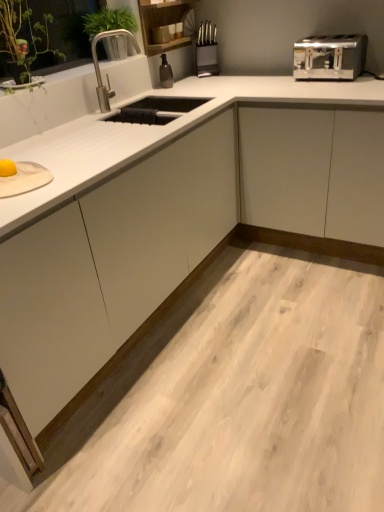
The width and height of the screenshot is (384, 512). I want to click on satin silver toaster at upper right, so point(330,57).

Identify the location of green leafy plant at upper left. The width and height of the screenshot is (384, 512). (109, 21).

From the image's perspective, relative to satin silver toaster at upper right, is green leafy plant at upper left above or below?

green leafy plant at upper left is situated higher than satin silver toaster at upper right in the image.

Considering the positions of points (128, 14) and (362, 58), is point (128, 14) closer to camera compared to point (362, 58)?

No, (128, 14) is further to viewer.

Looking at this image, is green leafy plant at upper left oriented away from satin silver toaster at upper right?

No, green leafy plant at upper left is not facing away from satin silver toaster at upper right.

Are green leafy plant at upper left and satin silver toaster at upper right located far from each other?

Yes, green leafy plant at upper left is far from satin silver toaster at upper right.

Does green leafy plant at upper left touch polished stainless steel faucet at upper left?

No, green leafy plant at upper left is not beside polished stainless steel faucet at upper left.

Considering the relative sizes of green leafy plant at upper left and polished stainless steel faucet at upper left in the image provided, is green leafy plant at upper left smaller than polished stainless steel faucet at upper left?

No.

Is green leafy plant at upper left wider or thinner than polished stainless steel faucet at upper left?

Considering their sizes, green leafy plant at upper left looks broader than polished stainless steel faucet at upper left.

In order to click on plant above the polished stainless steel faucet at upper left (from the image's perspective) in this screenshot , I will do [109, 21].

From a real-world perspective, who is located higher, satin silver toaster at upper right or polished stainless steel faucet at upper left?

In real-world perspective, polished stainless steel faucet at upper left is above.

Is point (299, 66) in front of point (93, 54)?

No, (299, 66) is behind (93, 54).

From the image's perspective, is satin silver toaster at upper right positioned above or below polished stainless steel faucet at upper left?

From the image's perspective, satin silver toaster at upper right appears above polished stainless steel faucet at upper left.

Is satin silver toaster at upper right inside or outside of polished stainless steel faucet at upper left?

satin silver toaster at upper right is spatially situated outside polished stainless steel faucet at upper left.

Looking at their sizes, would you say satin silver toaster at upper right is wider or thinner than green leafy plant at upper left?

satin silver toaster at upper right is wider than green leafy plant at upper left.

From a real-world perspective, is satin silver toaster at upper right above or below green leafy plant at upper left?

In terms of real-world spatial position, satin silver toaster at upper right is below green leafy plant at upper left.

From the image's perspective, which one is positioned higher, satin silver toaster at upper right or green leafy plant at upper left?

green leafy plant at upper left appears higher in the image.

Is satin silver toaster at upper right not near green leafy plant at upper left?

Yes, satin silver toaster at upper right and green leafy plant at upper left are located far from each other.

Is polished stainless steel faucet at upper left taller or shorter than green leafy plant at upper left?

Considering their sizes, polished stainless steel faucet at upper left has more height than green leafy plant at upper left.

Is polished stainless steel faucet at upper left facing towards green leafy plant at upper left?

No, polished stainless steel faucet at upper left is not facing towards green leafy plant at upper left.

Considering the sizes of objects polished stainless steel faucet at upper left and satin silver toaster at upper right in the image provided, who is wider, polished stainless steel faucet at upper left or satin silver toaster at upper right?

With larger width is satin silver toaster at upper right.

Is polished stainless steel faucet at upper left positioned before satin silver toaster at upper right?

Yes, it is in front of satin silver toaster at upper right.

Is satin silver toaster at upper right completely or partially inside polished stainless steel faucet at upper left?

That's incorrect, satin silver toaster at upper right is not inside polished stainless steel faucet at upper left.

I want to click on faucet located below the satin silver toaster at upper right (from the image's perspective), so click(x=107, y=73).

I want to click on plant that is above the satin silver toaster at upper right (from a real-world perspective), so click(109, 21).

Find the location of `plant located above the polished stainless steel faucet at upper left (from the image's perspective)`. plant located above the polished stainless steel faucet at upper left (from the image's perspective) is located at coordinates coord(109,21).

Estimate the real-world distances between objects in this image. Which object is further from satin silver toaster at upper right, green leafy plant at upper left or polished stainless steel faucet at upper left?

The object further to satin silver toaster at upper right is green leafy plant at upper left.

Estimate the real-world distances between objects in this image. Which object is further from green leafy plant at upper left, polished stainless steel faucet at upper left or satin silver toaster at upper right?

satin silver toaster at upper right is further to green leafy plant at upper left.

Looking at this image, which object lies nearer to the anchor point green leafy plant at upper left, satin silver toaster at upper right or polished stainless steel faucet at upper left?

polished stainless steel faucet at upper left.

Based on their spatial positions, is polished stainless steel faucet at upper left or green leafy plant at upper left closer to satin silver toaster at upper right?

polished stainless steel faucet at upper left is closer to satin silver toaster at upper right.

From the image, which object appears to be nearer to polished stainless steel faucet at upper left, green leafy plant at upper left or satin silver toaster at upper right?

green leafy plant at upper left.

When comparing their distances from polished stainless steel faucet at upper left, does satin silver toaster at upper right or green leafy plant at upper left seem further?

satin silver toaster at upper right.

Where is `faucet between green leafy plant at upper left and satin silver toaster at upper right from left to right`? Image resolution: width=384 pixels, height=512 pixels. faucet between green leafy plant at upper left and satin silver toaster at upper right from left to right is located at coordinates (107, 73).